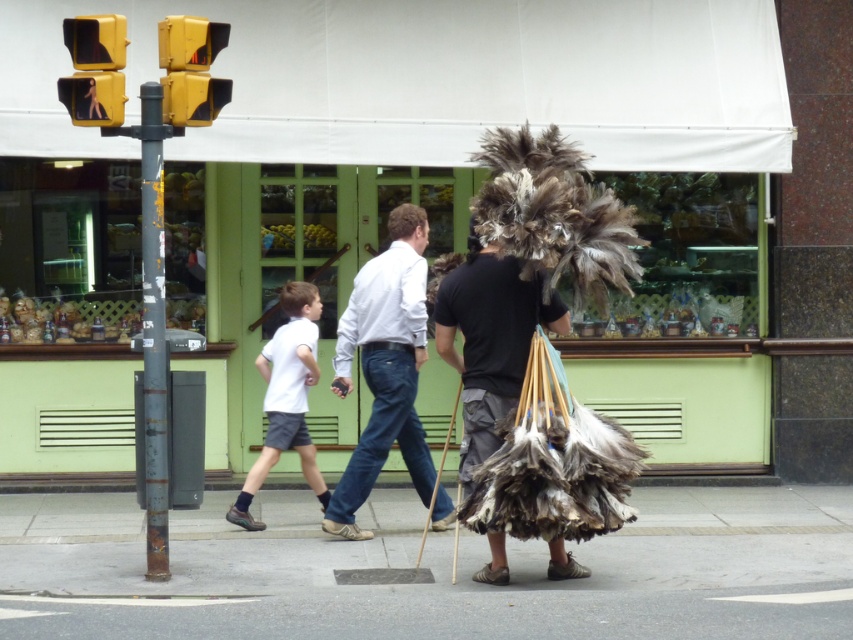
You are a delivery person trying to cross the street at the intersection. You see the yellow plastic pedestrian signal at upper left and the yellow matte traffic light at upper left. Which one indicates when it is safe to walk?

The yellow plastic pedestrian signal at upper left indicates when it is safe to walk, as pedestrian signals are designed to show walk signals, while traffic lights control vehicle movement.

You are a delivery robot with a width of 0.8 meters. You need to move along the smooth concrete sidewalk at lower center while avoiding the feathered bundle at center. Is there enough space for you to pass safely?

The distance between the smooth concrete sidewalk at lower center and the feathered bundle at center is 1.02 meters. Since the robot is 0.8 meters wide, there is sufficient space to pass safely as the distance is greater than the robot width.

You are a delivery drone flying above the street scene. You need to land on the smooth concrete sidewalk at lower center to drop off a package. However, you notice the white cotton shirt at center is in the way. Can you safely land on the sidewalk without hitting the shirt?

The smooth concrete sidewalk at lower center is shorter than the white cotton shirt at center, meaning the sidewalk is not long enough to accommodate the shirt. Therefore, you can safely land on the sidewalk without hitting the shirt since the sidewalk is shorter and the shirt extends beyond it.